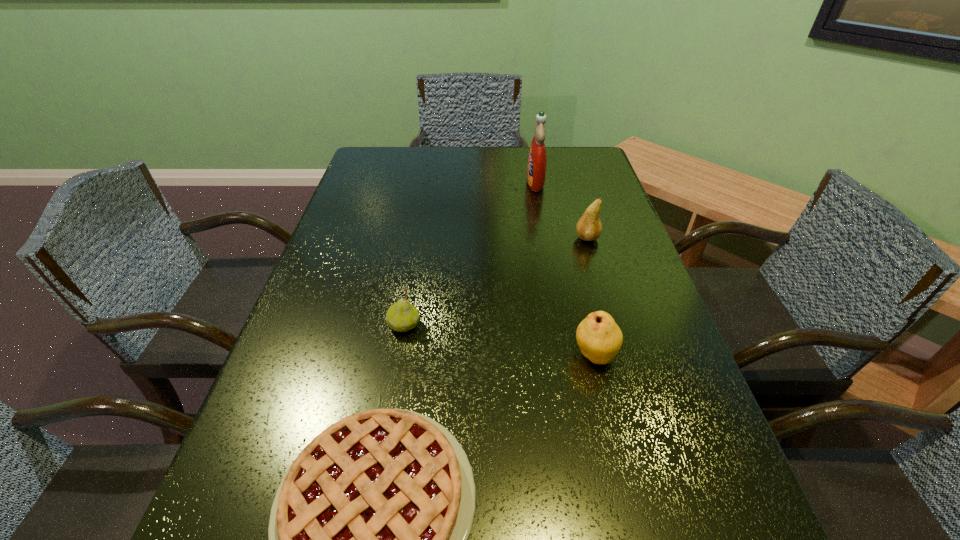
I want to click on vacant space that satisfies the following two spatial constraints: 1. on the front surface of the tallest object; 2. on the left side of the fourth nearest object, so click(x=545, y=238).

The image size is (960, 540). What are the coordinates of `free space that satisfies the following two spatial constraints: 1. on the front surface of the detergent; 2. on the right side of the fourth nearest object` in the screenshot? It's located at (545, 238).